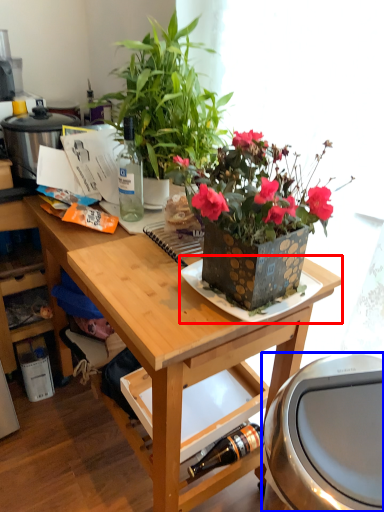
Question: Which object is further to the camera taking this photo, plate (highlighted by a red box) or appliance (highlighted by a blue box)?

Choices:
 (A) plate
 (B) appliance

Answer: (A)